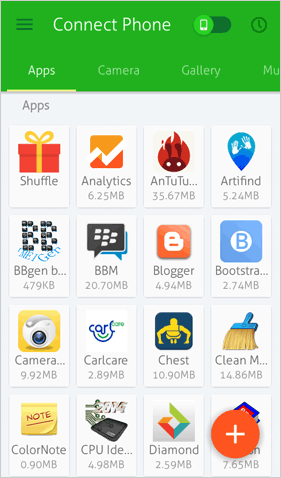
The height and width of the screenshot is (478, 281). Identify the location of clock. (259, 25).